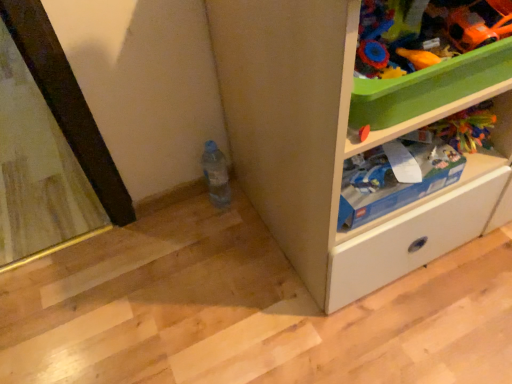
Question: From the image's perspective, is blue cardboard box at upper right over white matte cabinet at lower right?

Choices:
 (A) yes
 (B) no

Answer: (B)

Question: Can you confirm if blue cardboard box at upper right is positioned to the right of white matte cabinet at lower right?

Choices:
 (A) no
 (B) yes

Answer: (A)

Question: Are blue cardboard box at upper right and white matte cabinet at lower right located far from each other?

Choices:
 (A) yes
 (B) no

Answer: (B)

Question: From a real-world perspective, does blue cardboard box at upper right sit lower than white matte cabinet at lower right?

Choices:
 (A) no
 (B) yes

Answer: (B)

Question: Is blue cardboard box at upper right aimed at white matte cabinet at lower right?

Choices:
 (A) no
 (B) yes

Answer: (B)

Question: Is blue cardboard box at upper right spatially inside orange matte car at upper right, which appears as the first toy when viewed from the right, or outside of it?

Choices:
 (A) inside
 (B) outside

Answer: (B)

Question: Considering the positions of blue cardboard box at upper right and orange matte car at upper right, which appears as the first toy when viewed from the right, in the image, is blue cardboard box at upper right wider or thinner than orange matte car at upper right, which appears as the first toy when viewed from the right,?

Choices:
 (A) thin
 (B) wide

Answer: (B)

Question: Is blue cardboard box at upper right to the left or to the right of orange matte car at upper right, which appears as the first toy when viewed from the right, in the image?

Choices:
 (A) left
 (B) right

Answer: (A)

Question: Is blue cardboard box at upper right in front of or behind orange matte car at upper right, which is the second toy in left-to-right order, in the image?

Choices:
 (A) behind
 (B) front

Answer: (A)

Question: In the image, is white matte cabinet at lower right positioned in front of or behind translucent plastic bottle at lower center?

Choices:
 (A) front
 (B) behind

Answer: (A)

Question: From the image's perspective, is white matte cabinet at lower right located above or below translucent plastic bottle at lower center?

Choices:
 (A) above
 (B) below

Answer: (A)

Question: Is point (226, 69) closer or farther from the camera than point (210, 183)?

Choices:
 (A) closer
 (B) farther

Answer: (A)

Question: From a real-world perspective, is white matte cabinet at lower right positioned above or below translucent plastic bottle at lower center?

Choices:
 (A) below
 (B) above

Answer: (B)

Question: From a real-world perspective, is orange plastic spoon at upper right, the first toy from the left, positioned above or below orange matte car at upper right, which is the second toy in left-to-right order?

Choices:
 (A) above
 (B) below

Answer: (B)

Question: Considering the positions of orange plastic spoon at upper right, the 2th toy positioned from the right, and orange matte car at upper right, which appears as the first toy when viewed from the right, in the image, is orange plastic spoon at upper right, the 2th toy positioned from the right, bigger or smaller than orange matte car at upper right, which appears as the first toy when viewed from the right,?

Choices:
 (A) small
 (B) big

Answer: (A)